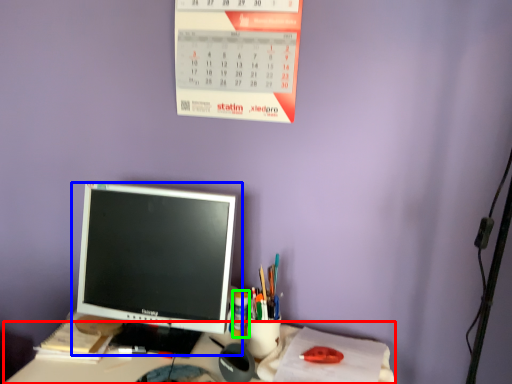
Question: Which object is the farthest from desk (highlighted by a red box)? Choose among these: computer monitor (highlighted by a blue box) or stationery (highlighted by a green box).

Choices:
 (A) computer monitor
 (B) stationery

Answer: (A)